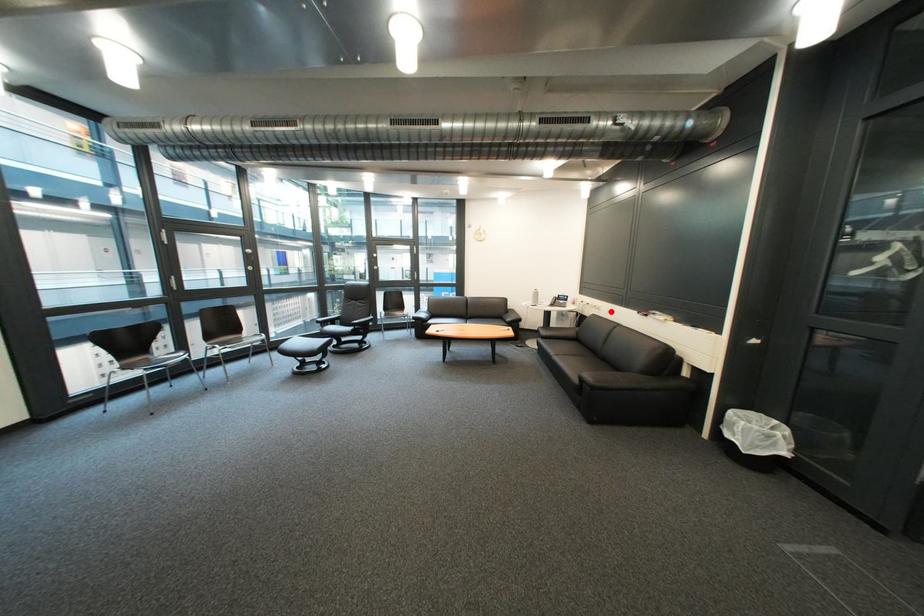
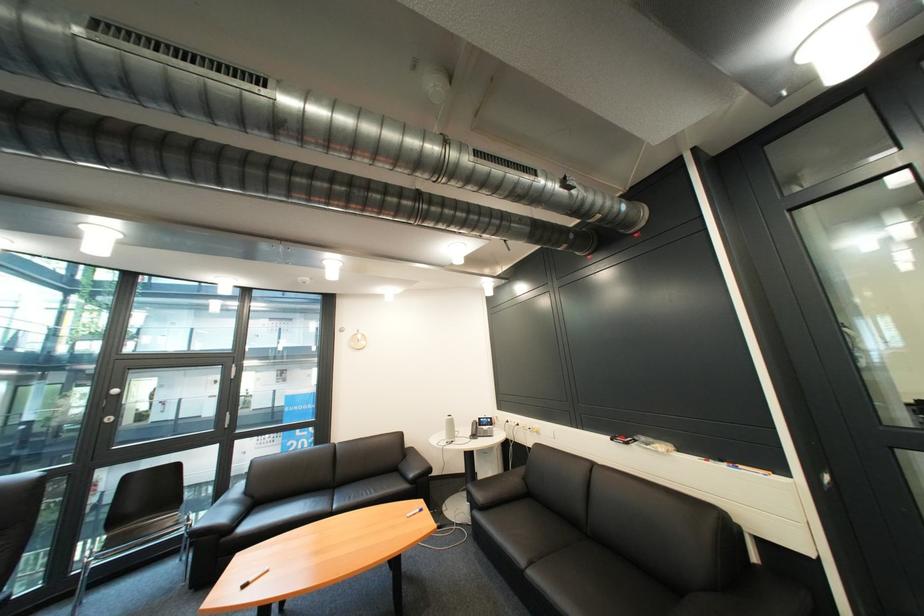
The point at the highlighted location is marked in the first image. Where is the corresponding point in the second image?

(549, 435)